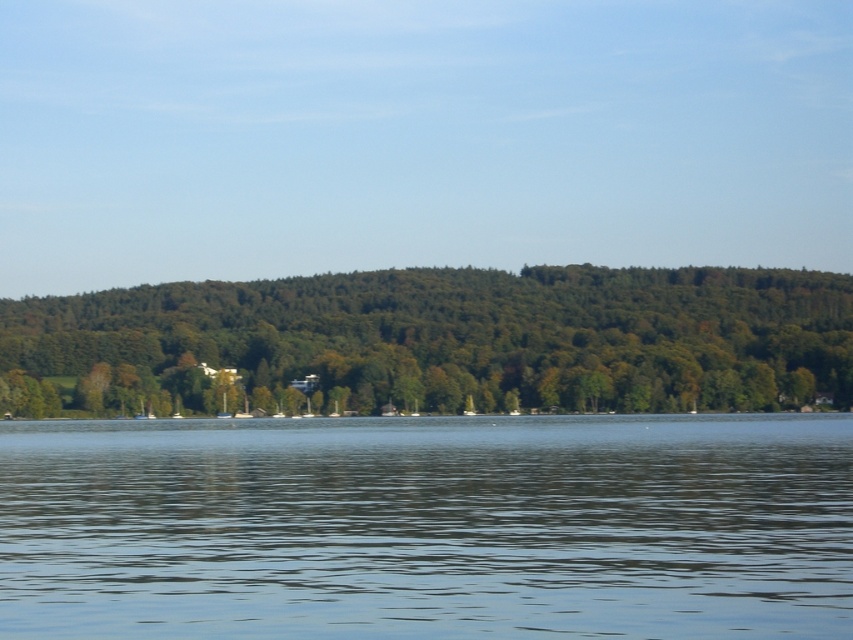
You are standing at the lakeside and want to take a photo of the green leafy trees at center while avoiding the transparent water at center from appearing in the foreground. Is it possible to adjust your position or angle to achieve this?

The transparent water at center is in front of the green leafy trees at center, so adjusting your position or angle might not fully eliminate the water from the foreground since the water is directly between you and the trees. However, tilting the camera upward or moving to a higher vantage point could minimize the water in the frame while still capturing the trees.

In the scene shown: You are standing at the lakeside and looking at the scene. There are two points marked in the image, point [474,616] and point [393,396]. Which point is closer to you?

Point [474,616] is closer to the camera than point [393,396].